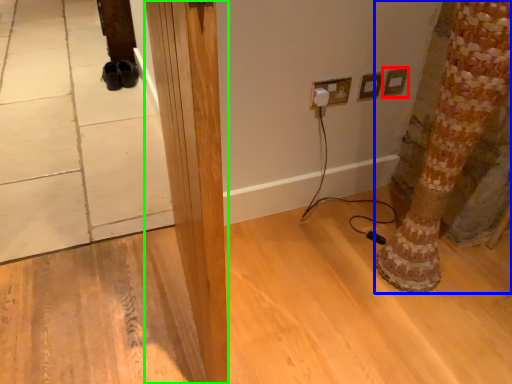
Question: Which is farther away from electric outlet (highlighted by a red box)? tree trunk (highlighted by a blue box) or pillar (highlighted by a green box)?

Choices:
 (A) tree trunk
 (B) pillar

Answer: (B)